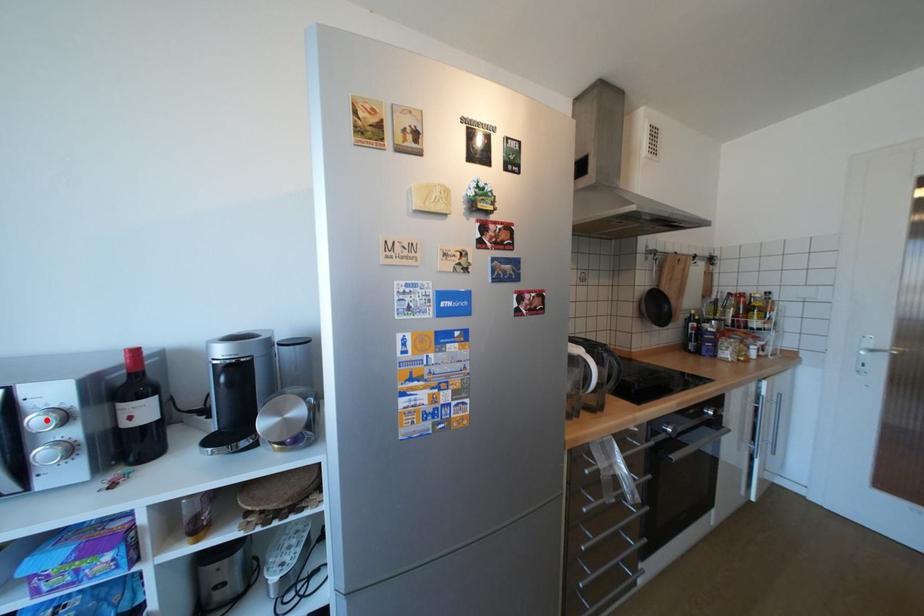
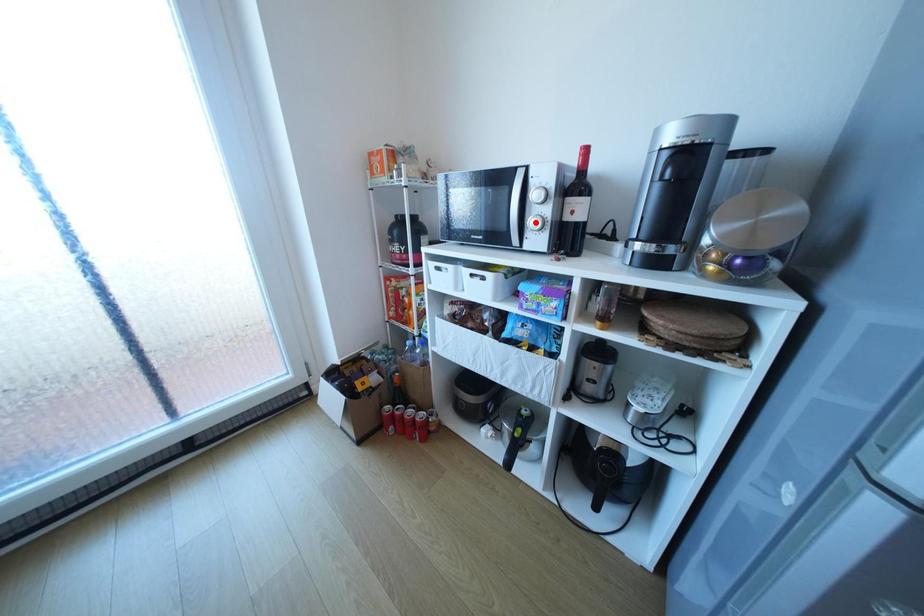
I am providing you with two images of the same scene from different viewpoints. A red point is marked on the first image and another point is marked on the second image. Are the points marked in image1 and image2 representing the same 3D position?

No